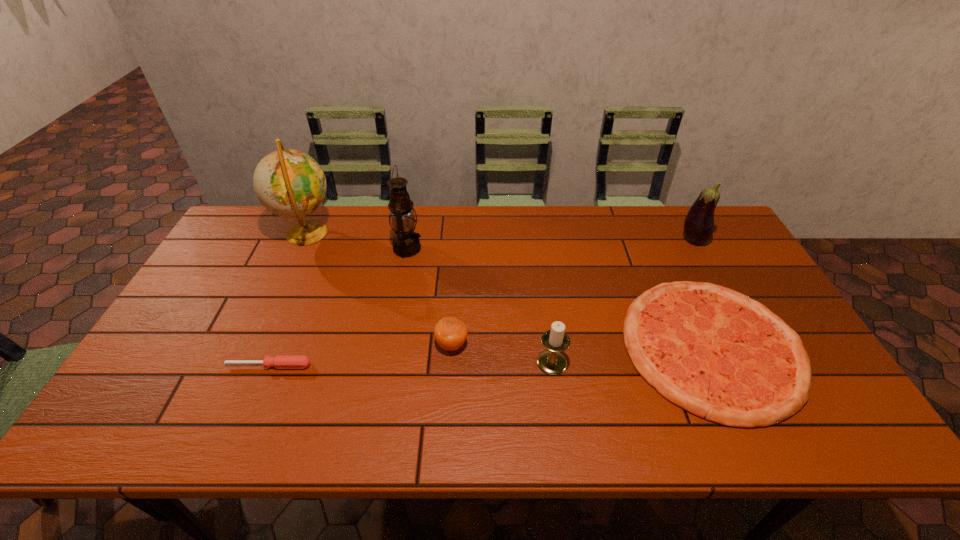
You are a GUI agent. You are given a task and a screenshot of the screen. Output one action in this format:
    pyautogui.click(x=<x>, y=<y>)
    Task: Click on the vacant region located on the left of the third object from left to right
    This screenshot has height=540, width=960.
    Given the screenshot: What is the action you would take?
    pyautogui.click(x=359, y=248)

The width and height of the screenshot is (960, 540). Find the location of `vacant space situated 0.200m on the left of the eggplant`. vacant space situated 0.200m on the left of the eggplant is located at coordinates [619, 239].

Where is `vacant space located on the back of the candle holder`? Image resolution: width=960 pixels, height=540 pixels. vacant space located on the back of the candle holder is located at coordinates (540, 277).

I want to click on vacant space located 0.190m on the right of the orange, so click(540, 345).

You are a GUI agent. You are given a task and a screenshot of the screen. Output one action in this format:
    pyautogui.click(x=<x>, y=<y>)
    Task: Click on the free location located on the back of the pizza
    The height and width of the screenshot is (540, 960).
    Given the screenshot: What is the action you would take?
    pyautogui.click(x=650, y=213)

I want to click on blank space located on the back of the shortest object, so click(285, 327).

Find the location of a particular element. This screenshot has width=960, height=540. globe situated at the far edge is located at coordinates (289, 183).

Locate an element on the screen. The height and width of the screenshot is (540, 960). oil lamp at the far edge is located at coordinates (406, 243).

At what (x,y) coordinates should I click in order to perform the action: click on eggplant present at the far edge. Please return your answer as a coordinate pair (x, y). This screenshot has height=540, width=960. Looking at the image, I should click on (699, 223).

Find the location of a particular element. The image size is (960, 540). object present at the near edge is located at coordinates (718, 354).